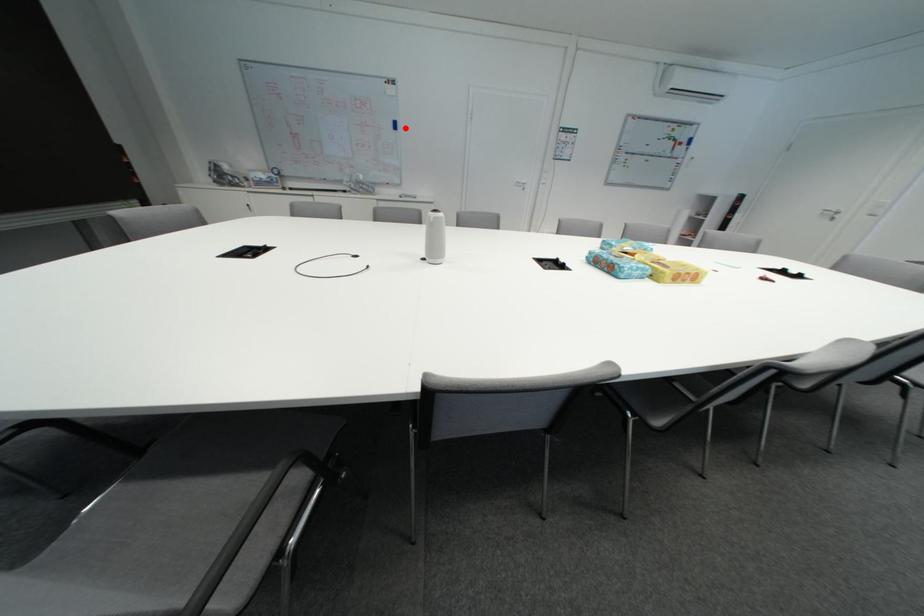
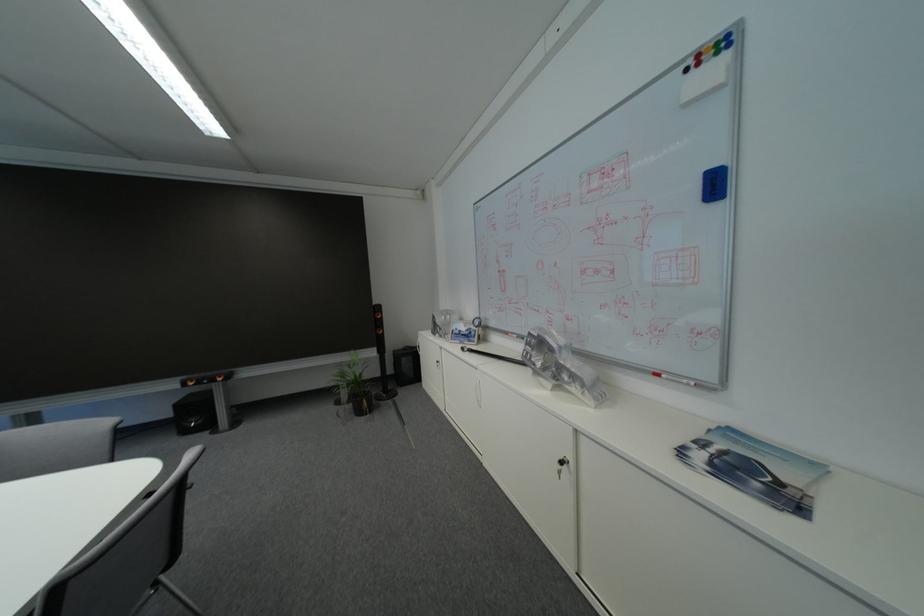
Question: I am providing you with two images of the same scene from different viewpoints. Given a red point in image1, look at the same physical point in image2. Is it:

Choices:
 (A) Closer to the viewpoint
 (B) Farther from the viewpoint

Answer: (B)